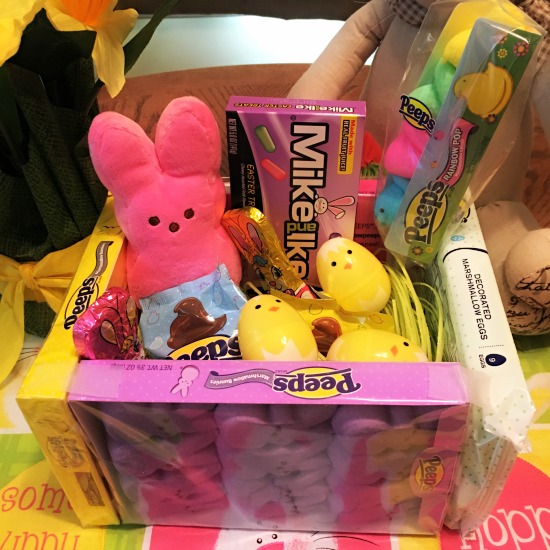
The image size is (550, 550). I want to click on table, so click(204, 90).